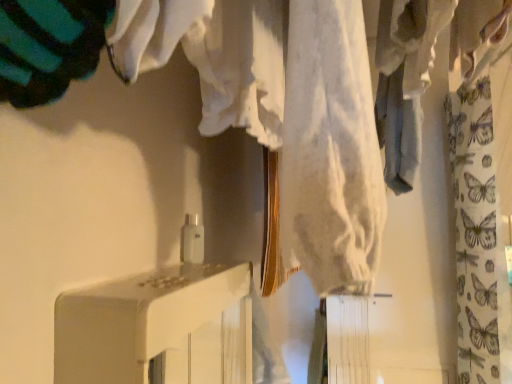
Question: Is white glossy cabinet at center inside the boundaries of butterfly-patterned fabric at right, or outside?

Choices:
 (A) outside
 (B) inside

Answer: (A)

Question: Looking at their shapes, would you say white glossy cabinet at center is wider or thinner than butterfly-patterned fabric at right?

Choices:
 (A) wide
 (B) thin

Answer: (B)

Question: Is white glossy cabinet at center bigger or smaller than butterfly-patterned fabric at right?

Choices:
 (A) small
 (B) big

Answer: (A)

Question: Considering the positions of butterfly-patterned fabric at right and white glossy cabinet at center in the image, is butterfly-patterned fabric at right taller or shorter than white glossy cabinet at center?

Choices:
 (A) short
 (B) tall

Answer: (B)

Question: Visually, is butterfly-patterned fabric at right positioned to the left or to the right of white glossy cabinet at center?

Choices:
 (A) right
 (B) left

Answer: (A)

Question: Is butterfly-patterned fabric at right spatially inside white glossy cabinet at center, or outside of it?

Choices:
 (A) inside
 (B) outside

Answer: (B)

Question: From a real-world perspective, is butterfly-patterned fabric at right positioned above or below white glossy cabinet at center?

Choices:
 (A) below
 (B) above

Answer: (B)